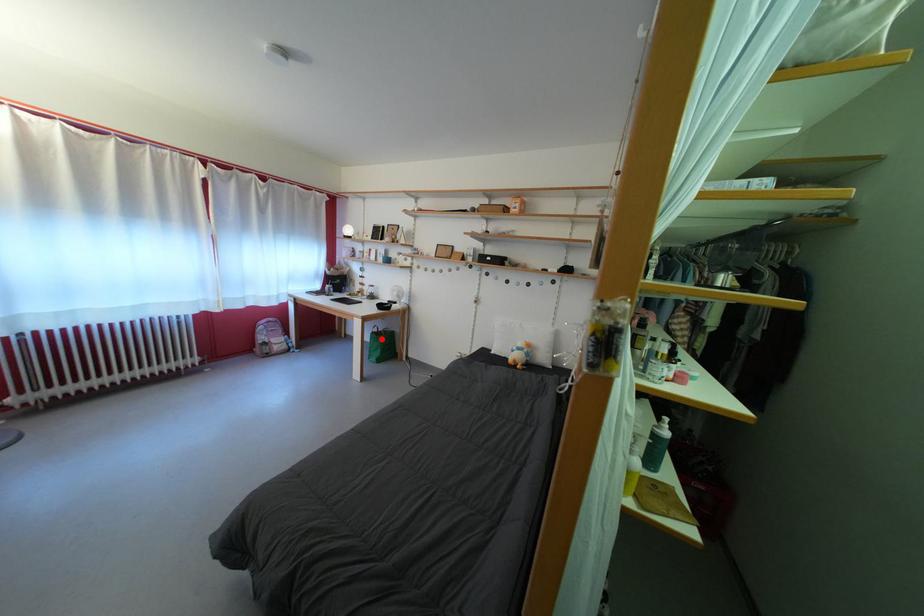
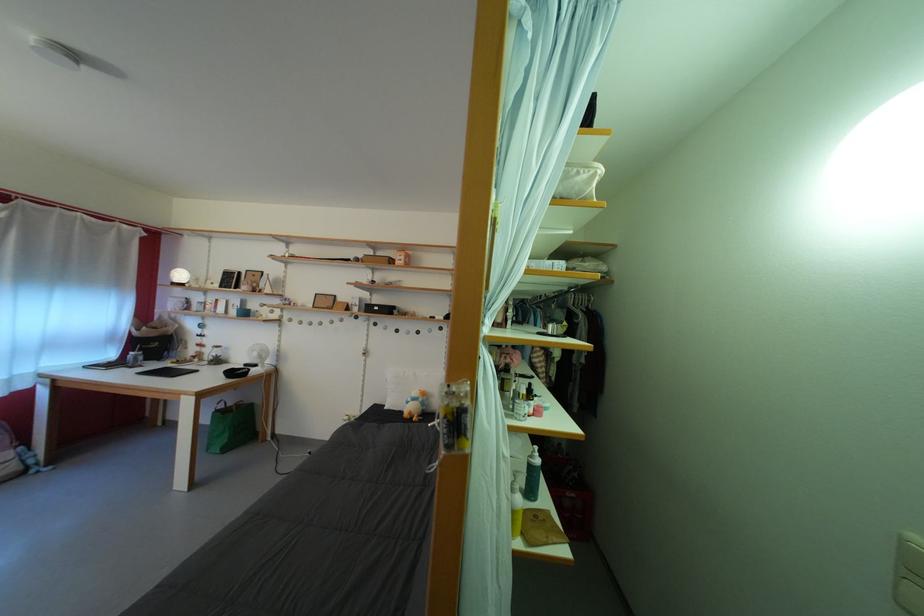
In the second image, find the point that corresponds to the highlighted location in the first image.

(225, 416)